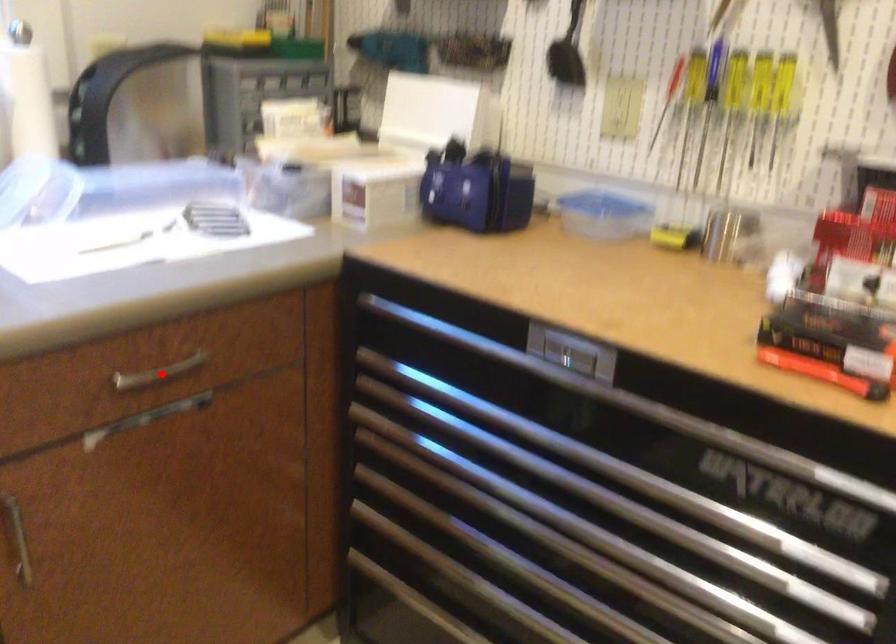
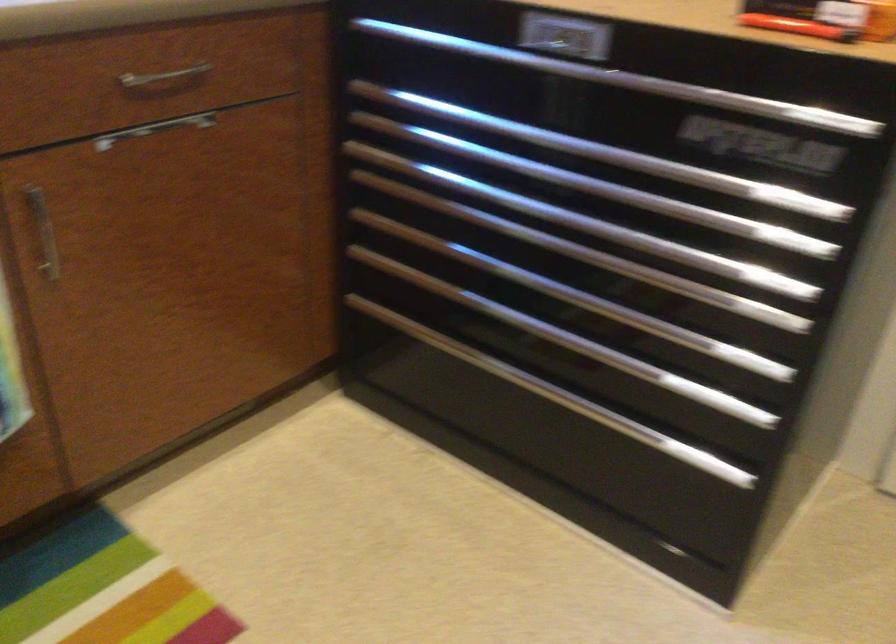
Question: I am providing you with two images of the same scene from different viewpoints. A red point is marked on the first image. At the location where the point appears in image 1, is it still visible in image 2?

Choices:
 (A) Yes
 (B) No

Answer: (A)